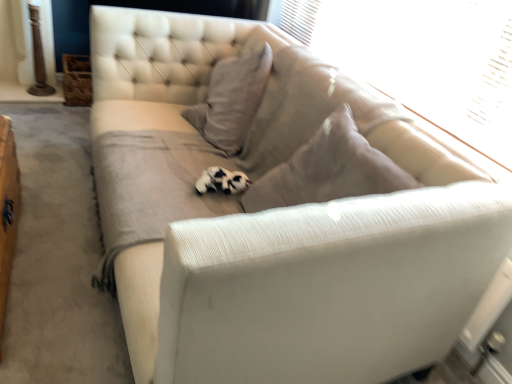
Identify the location of transparent plastic window screen at upper right. (422, 57).

The image size is (512, 384). What do you see at coordinates (422, 57) in the screenshot?
I see `transparent plastic window screen at upper right` at bounding box center [422, 57].

This screenshot has height=384, width=512. I want to click on black and white fur at center, so click(x=222, y=181).

This screenshot has width=512, height=384. What do you see at coordinates (222, 181) in the screenshot? I see `black and white fur at center` at bounding box center [222, 181].

I want to click on transparent plastic window screen at upper right, so click(x=422, y=57).

Which is more to the right, transparent plastic window screen at upper right or black and white fur at center?

transparent plastic window screen at upper right.

Is transparent plastic window screen at upper right in front of or behind black and white fur at center in the image?

Clearly, transparent plastic window screen at upper right is in front of black and white fur at center.

Between point (309, 12) and point (232, 172), which one is positioned in front?

The point (232, 172) is in front.

In the scene shown: From the image's perspective, relative to black and white fur at center, is transparent plastic window screen at upper right above or below?

transparent plastic window screen at upper right is above black and white fur at center.

From a real-world perspective, relative to black and white fur at center, is transparent plastic window screen at upper right vertically above or below?

transparent plastic window screen at upper right is above black and white fur at center.

Which of these two, transparent plastic window screen at upper right or black and white fur at center, is wider?

black and white fur at center is wider.

Considering the sizes of transparent plastic window screen at upper right and black and white fur at center in the image, is transparent plastic window screen at upper right taller or shorter than black and white fur at center?

Considering their sizes, transparent plastic window screen at upper right has more height than black and white fur at center.

Is transparent plastic window screen at upper right bigger or smaller than black and white fur at center?

transparent plastic window screen at upper right is bigger than black and white fur at center.

Is transparent plastic window screen at upper right situated inside black and white fur at center or outside?

transparent plastic window screen at upper right is located beyond the bounds of black and white fur at center.

Is transparent plastic window screen at upper right with black and white fur at center?

No, transparent plastic window screen at upper right is not in contact with black and white fur at center.

Is transparent plastic window screen at upper right positioned with its back to black and white fur at center?

No, transparent plastic window screen at upper right is not facing away from black and white fur at center.

Can you tell me how much transparent plastic window screen at upper right and black and white fur at center differ in facing direction?

The angle between the facing direction of transparent plastic window screen at upper right and the facing direction of black and white fur at center is 0.139 degrees.

Locate an element on the screen. The image size is (512, 384). animal on the left of transparent plastic window screen at upper right is located at coordinates (222, 181).

Between black and white fur at center and transparent plastic window screen at upper right, which one appears on the left side from the viewer's perspective?

Positioned to the left is black and white fur at center.

Which is in front, black and white fur at center or transparent plastic window screen at upper right?

transparent plastic window screen at upper right.

Which is behind, point (231, 193) or point (405, 105)?

The point (405, 105) is farther.

From the image's perspective, is black and white fur at center above or below transparent plastic window screen at upper right?

Based on their image positions, black and white fur at center is located beneath transparent plastic window screen at upper right.

From a real-world perspective, relative to transparent plastic window screen at upper right, is black and white fur at center vertically above or below?

black and white fur at center is situated lower than transparent plastic window screen at upper right in the real world.

Considering the sizes of objects black and white fur at center and transparent plastic window screen at upper right in the image provided, who is thinner, black and white fur at center or transparent plastic window screen at upper right?

Thinner between the two is transparent plastic window screen at upper right.

Looking at this image, can you confirm if black and white fur at center is shorter than transparent plastic window screen at upper right?

Yes.

In terms of size, does black and white fur at center appear bigger or smaller than transparent plastic window screen at upper right?

In the image, black and white fur at center appears to be smaller than transparent plastic window screen at upper right.

Is black and white fur at center spatially inside transparent plastic window screen at upper right, or outside of it?

black and white fur at center is not enclosed by transparent plastic window screen at upper right.

Are black and white fur at center and transparent plastic window screen at upper right making contact?

No, black and white fur at center is not in contact with transparent plastic window screen at upper right.

Could you tell me if black and white fur at center is facing transparent plastic window screen at upper right?

No, black and white fur at center is not facing towards transparent plastic window screen at upper right.

How far apart are black and white fur at center and transparent plastic window screen at upper right?

black and white fur at center is 1.06 meters from transparent plastic window screen at upper right.

Where is `window screen above the black and white fur at center (from a real-world perspective)`? This screenshot has height=384, width=512. window screen above the black and white fur at center (from a real-world perspective) is located at coordinates tap(422, 57).

Image resolution: width=512 pixels, height=384 pixels. I want to click on animal behind the transparent plastic window screen at upper right, so click(222, 181).

Where is `window screen above the black and white fur at center (from a real-world perspective)`? window screen above the black and white fur at center (from a real-world perspective) is located at coordinates (422, 57).